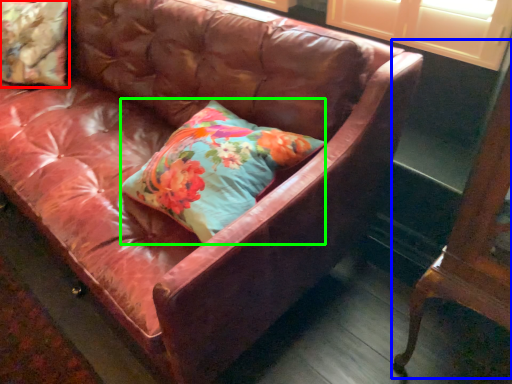
Question: Which object is the farthest from pillow (highlighted by a red box)? Choose among these: furniture (highlighted by a blue box) or pillow (highlighted by a green box).

Choices:
 (A) furniture
 (B) pillow

Answer: (A)